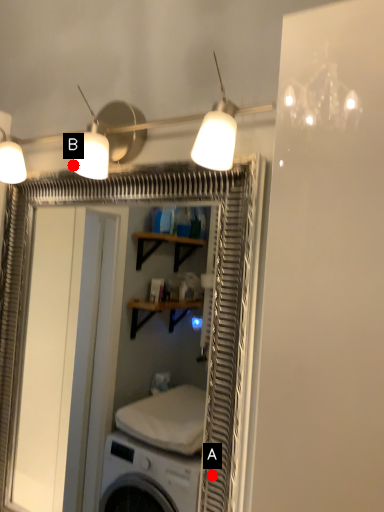
Question: Two points are circled on the image, labeled by A and B beside each circle. Which of the following is the closest to the observer?

Choices:
 (A) A is closer
 (B) B is closer

Answer: (A)